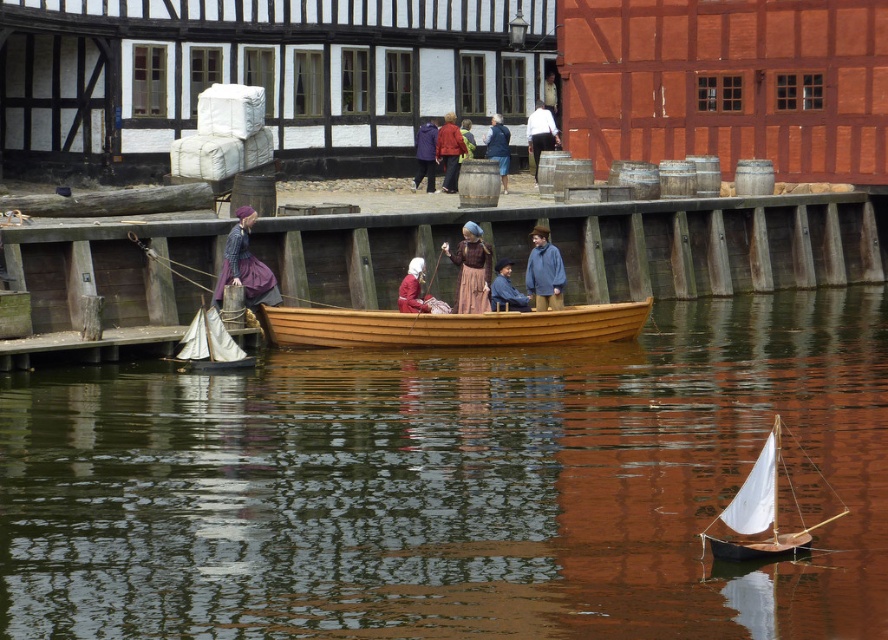
You are an event planner trying to arrange a photo shoot on the wooden dock at center and the blue woolen jacket at center. To ensure proper lighting, you need to know which object is further to the right. Which one is it?

The wooden dock at center is positioned on the right side of blue woolen jacket at center, so the wooden dock at center is further to the right.

You are standing on the wooden dock at center and want to see the matte purple dress at center. Which direction should you look to see it?

The wooden dock at center is in front of matte purple dress at center, so you should look behind you to see the matte purple dress at center.